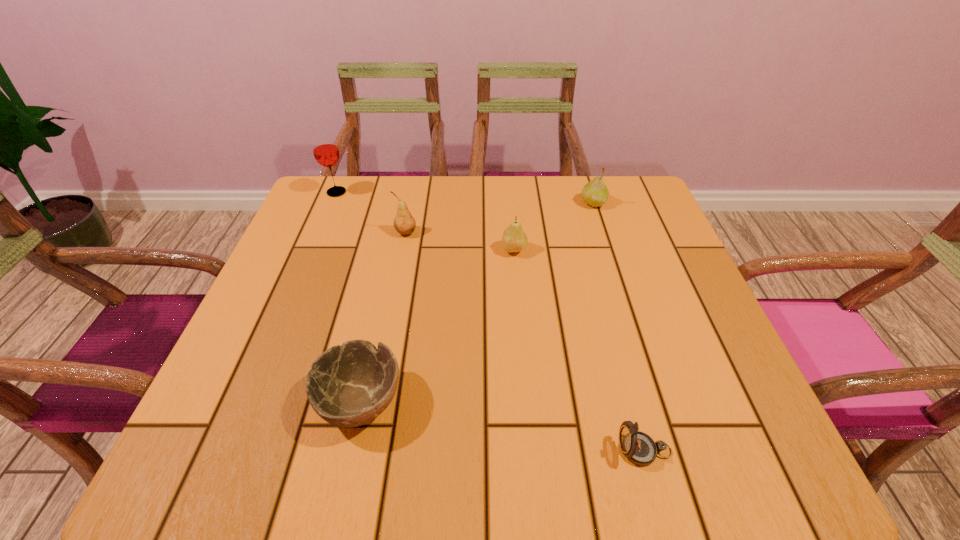
Find the location of a particular element. The image size is (960, 540). blank region between the compass and the farthest pear is located at coordinates click(619, 327).

Where is `empty space that is in between the glass and the compass`? empty space that is in between the glass and the compass is located at coordinates (491, 321).

Where is `object identified as the third closest to the second farthest pear`? This screenshot has height=540, width=960. object identified as the third closest to the second farthest pear is located at coordinates (349, 385).

Find the location of a particular element. object that is the second closest to the farthest pear is located at coordinates (404, 223).

Find the location of `pear that is the closest to the glass`. pear that is the closest to the glass is located at coordinates (404, 223).

Image resolution: width=960 pixels, height=540 pixels. I want to click on the second closest pear to the third object from right to left, so click(404, 223).

This screenshot has height=540, width=960. In order to click on vacant region that satisfies the following two spatial constraints: 1. on the front side of the glass; 2. on the right side of the bowl in this screenshot , I will do [x=249, y=402].

The width and height of the screenshot is (960, 540). I want to click on free space that satisfies the following two spatial constraints: 1. on the front side of the leftmost object; 2. on the left side of the bowl, so click(x=249, y=402).

Where is `free location that satisfies the following two spatial constraints: 1. on the front side of the glass; 2. on the right side of the rightmost pear`? This screenshot has height=540, width=960. free location that satisfies the following two spatial constraints: 1. on the front side of the glass; 2. on the right side of the rightmost pear is located at coordinates (332, 203).